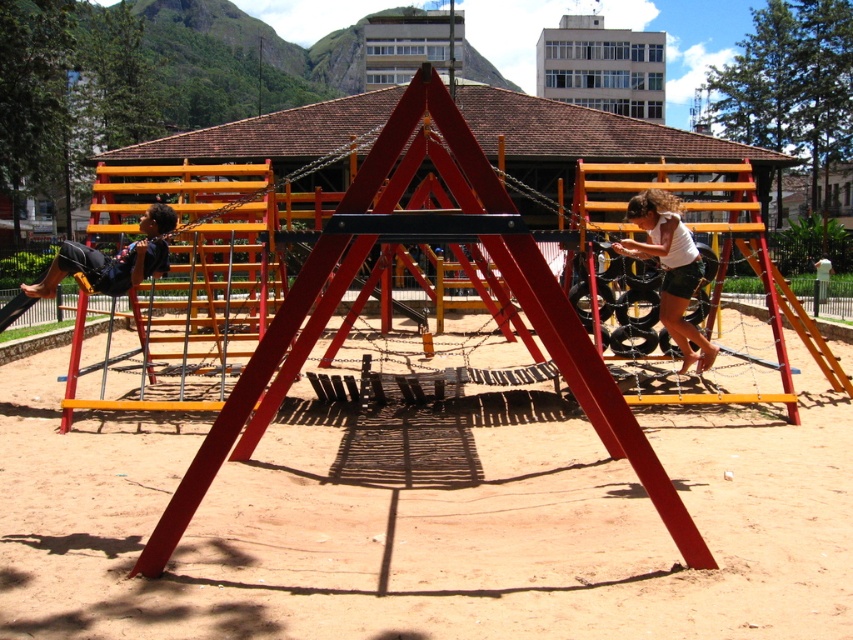
You are a photographer trying to capture a photo of the playground scene. You notice the white cotton shirt at upper right in your frame. Based on its coordinates, can you determine if it will be centered in the photo?

The white cotton shirt at upper right is located at point (670, 268). Since the center of the photo would be at coordinates (426, 320), the shirt is slightly to the left and below the center point, so it won

You are a photographer positioned at the center of the playground. You want to take a photo of the white cotton shirt at upper right and the matte black shorts at left. Which object should you adjust your camera to focus on first if you want to capture both in the frame without moving your position?

The white cotton shirt at upper right is to the right of matte black shorts at left, so you should focus on the matte black shorts at left first to ensure both are in the frame.

You are a photographer trying to capture both the white cotton shirt at upper right and the matte black shorts at left in a single frame. Which object should you focus on first to ensure both are in the frame?

The white cotton shirt at upper right is wider than the matte black shorts at left, so focusing on the wider object first will help ensure both fit within the frame.